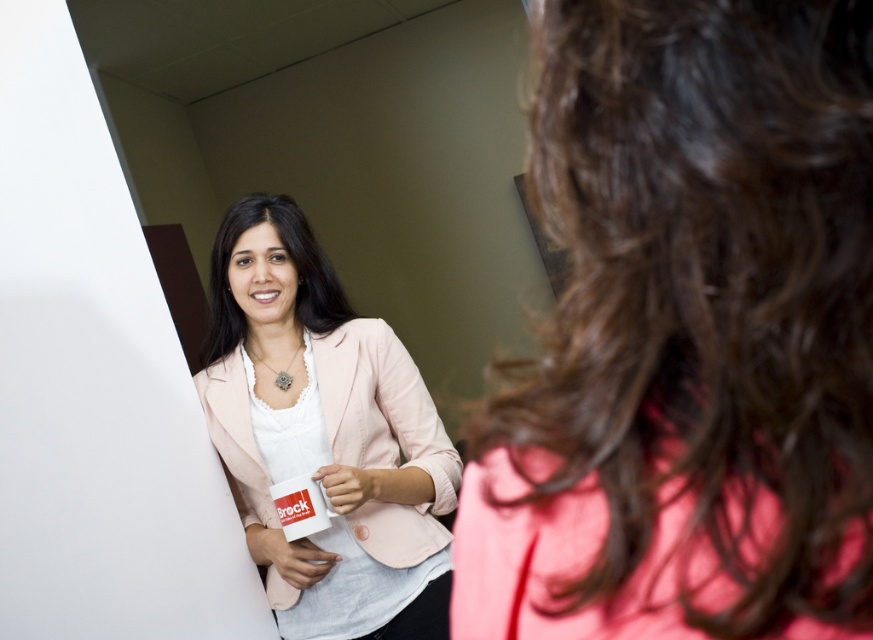
You are standing in the office and need to locate the matte pink blazer at upper left. According to the coordinates provided, where exactly is it positioned?

The matte pink blazer at upper left is located at point coordinates (688, 336).

You are a photographer trying to capture a clear shot of both the matte pink blazer at upper left and the matte pink blazer at center. Which blazer should you focus on first to ensure it appears sharp in the photo?

You should focus on the matte pink blazer at upper left first because it is closer to the viewer, so capturing it sharply will ensure the foreground is in focus before adjusting for the matte pink blazer at center in the background.